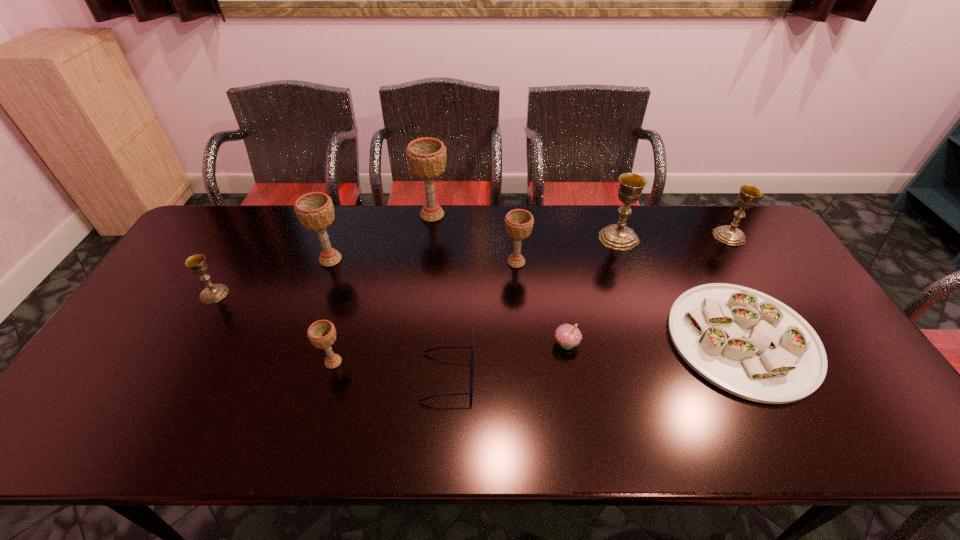
Locate an element on the screen. The image size is (960, 540). chalice that is at the right edge is located at coordinates (730, 235).

At what (x,y) coordinates should I click in order to perform the action: click on platter at the right edge. Please return your answer as a coordinate pair (x, y). This screenshot has width=960, height=540. Looking at the image, I should click on (747, 343).

The image size is (960, 540). I want to click on object located at the far right corner, so click(730, 235).

Identify the location of free spot at the far edge of the desktop. (497, 249).

Where is `free space at the near edge`? This screenshot has width=960, height=540. free space at the near edge is located at coordinates (520, 433).

This screenshot has height=540, width=960. Find the location of `vacant space at the left edge of the desktop`. vacant space at the left edge of the desktop is located at coordinates (160, 366).

You are a GUI agent. You are given a task and a screenshot of the screen. Output one action in this format:
    pyautogui.click(x=<x>, y=<y>)
    Task: Click on the vacant space at the right edge of the desktop
    The image size is (960, 540).
    Given the screenshot: What is the action you would take?
    pyautogui.click(x=748, y=267)

Locate an element on the screen. This screenshot has width=960, height=540. vacant region at the far left corner of the desktop is located at coordinates (231, 241).

The width and height of the screenshot is (960, 540). In the image, there is a desktop. Identify the location of vacant space at the far right corner. (757, 227).

Locate an element on the screen. This screenshot has width=960, height=540. free spot between the second biggest gold chalice and the sixth farthest chalice is located at coordinates (472, 265).